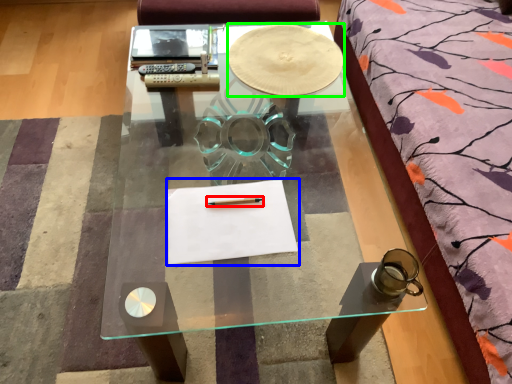
Question: Which is farther away from pencil (highlighted by a red box)? notebook (highlighted by a blue box) or round table (highlighted by a green box)?

Choices:
 (A) notebook
 (B) round table

Answer: (B)